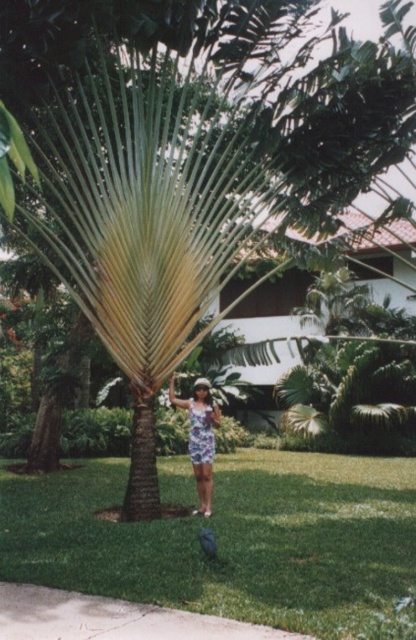
Question: Does concrete sidewalk at lower center appear on the right side of printed fabric dress at center?

Choices:
 (A) yes
 (B) no

Answer: (B)

Question: Does concrete sidewalk at lower center have a lesser width compared to printed fabric dress at center?

Choices:
 (A) yes
 (B) no

Answer: (B)

Question: Which of the following is the farthest from the observer?

Choices:
 (A) green grass at center
 (B) concrete sidewalk at lower center
 (C) printed fabric dress at center

Answer: (C)

Question: Among these points, which one is nearest to the camera?

Choices:
 (A) (396, 476)
 (B) (193, 456)
 (C) (62, 611)

Answer: (C)

Question: Can you confirm if concrete sidewalk at lower center is positioned to the left of printed fabric dress at center?

Choices:
 (A) yes
 (B) no

Answer: (A)

Question: Which object appears closest to the camera in this image?

Choices:
 (A) printed fabric dress at center
 (B) concrete sidewalk at lower center
 (C) green grass at center

Answer: (B)